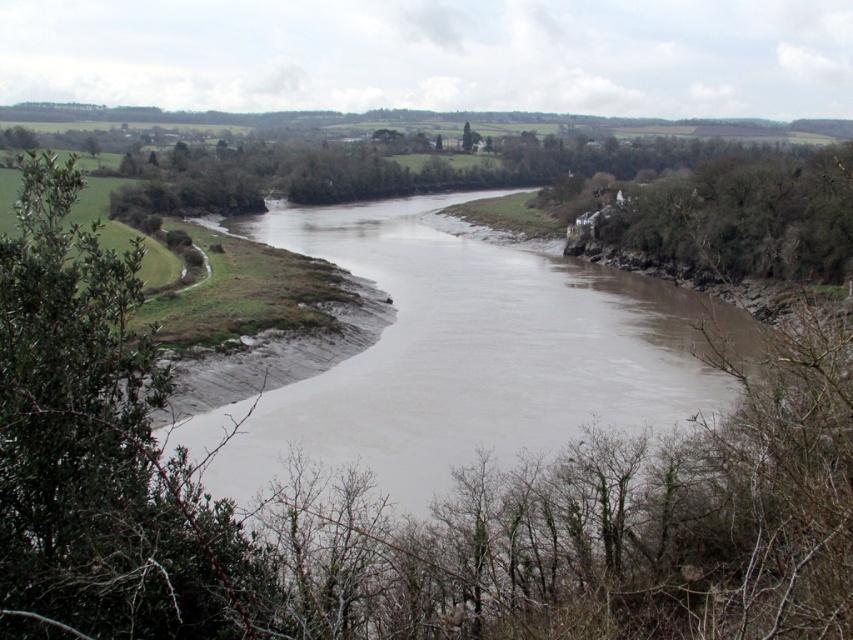
You are standing on the riverbank and want to cross to the opposite side. The muddy water at center flows towards the green leafy bush at left. Which direction should you aim to cross to avoid the current?

The muddy water at center is above the green leafy bush at left, meaning the current flows from the center towards the left. To avoid the current, you should aim to cross downstream, towards the direction of the green leafy bush at left, where the current is weaker.

You are standing at the point closer to the camera in the image. Which point are you standing at, point (490, 424) or point (99, 284)?

You are standing at point (99, 284) because it is closer to the camera than point (490, 424).

You are planning to cross the river using a small boat that can only carry items up to the size of the green leafy bush at left. Can you safely transport the muddy water at center across the river?

The muddy water at center is larger in size than the green leafy bush at left, so the boat cannot safely transport the muddy water at center since it exceeds the maximum capacity.